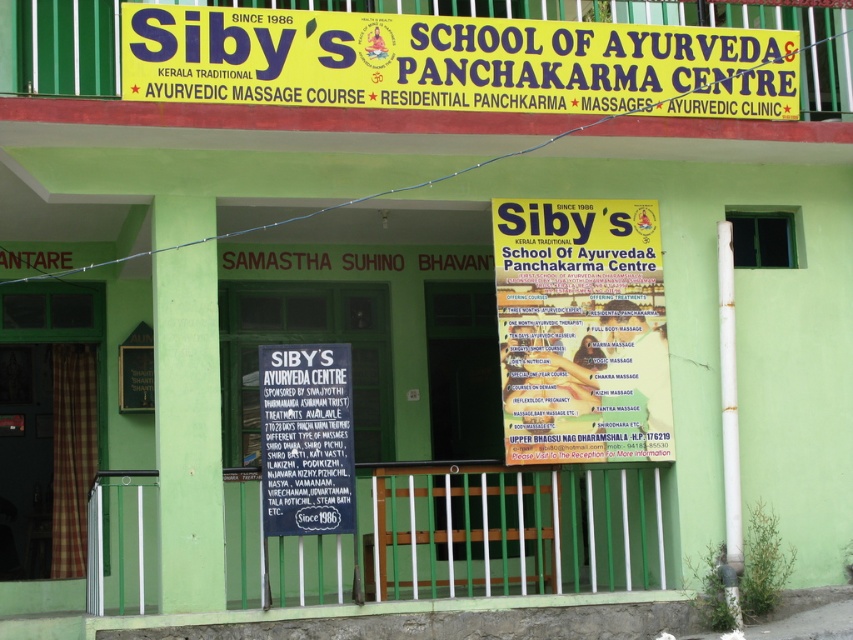
You are a visitor approaching the building and want to read both the yellow paper flyer at center and the matte black signboard at center. Which one do you need to look up higher to see?

The yellow paper flyer at center is taller than the matte black signboard at center, so you need to look up higher to see the yellow paper flyer at center.

You are a visitor looking for the Ayurvedic clinic. You see the yellow paper flyer at center and the matte black signboard at center. Which one is larger in size?

The yellow paper flyer at center is bigger than the matte black signboard at center, so the yellow paper flyer at center is larger in size.